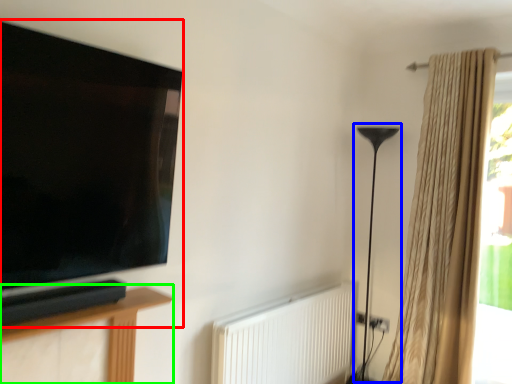
Question: Which object is the farthest from television (highlighted by a red box)? Choose among these: table lamp (highlighted by a blue box) or furniture (highlighted by a green box).

Choices:
 (A) table lamp
 (B) furniture

Answer: (A)